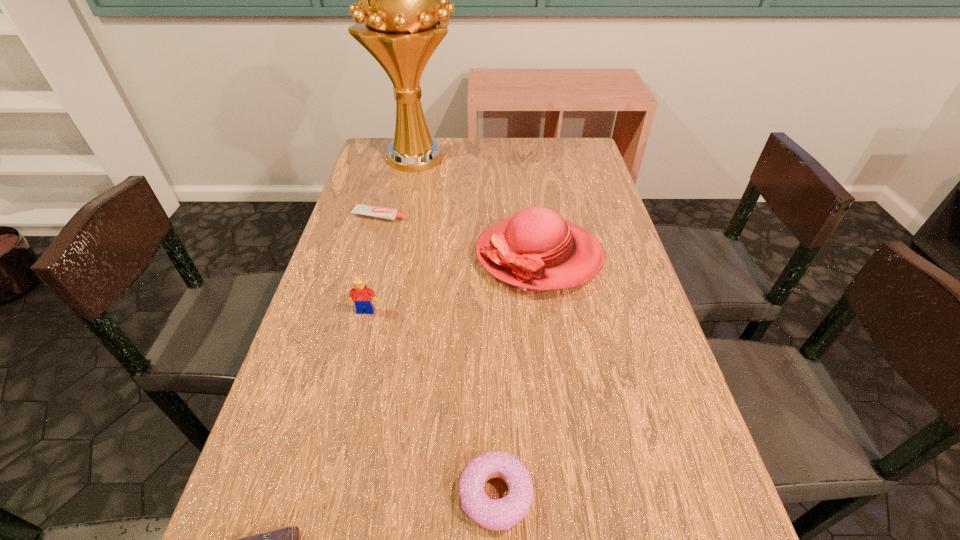
Identify the location of vacant space situated at the front of the second tallest object with a bow. The height and width of the screenshot is (540, 960). (390, 255).

You are a GUI agent. You are given a task and a screenshot of the screen. Output one action in this format:
    pyautogui.click(x=<x>, y=<y>)
    Task: Click on the free space located on the front-facing side of the third nearest object
    The height and width of the screenshot is (540, 960).
    Given the screenshot: What is the action you would take?
    348,380

Locate an element on the screen. The width and height of the screenshot is (960, 540). vacant space located 0.150m on the back of the fourth tallest object is located at coordinates (494, 383).

Find the location of a particular element. The height and width of the screenshot is (540, 960). free space located 0.280m on the right of the toothpaste is located at coordinates (503, 215).

Where is `object present at the far edge`? The height and width of the screenshot is (540, 960). object present at the far edge is located at coordinates (402, 15).

I want to click on trophy_cup at the left edge, so click(402, 15).

The width and height of the screenshot is (960, 540). In order to click on Lego that is at the left edge in this screenshot , I will do `click(360, 294)`.

In order to click on toothpaste positioned at the left edge in this screenshot , I will do `click(381, 212)`.

Locate an element on the screen. object that is at the right edge is located at coordinates (536, 250).

Where is `object at the far left corner`? object at the far left corner is located at coordinates (402, 15).